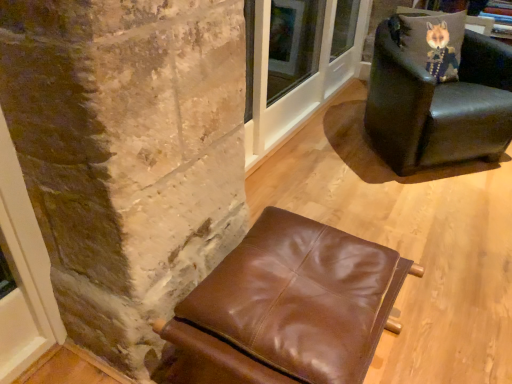
Question: From the image's perspective, is brown leather ottoman at lower center, which appears as the 1th chair when ordered from the bottom, positioned above or below velvet fox pillow at upper right?

Choices:
 (A) below
 (B) above

Answer: (A)

Question: Is brown leather ottoman at lower center, arranged as the 1th chair when viewed from the front, inside or outside of velvet fox pillow at upper right?

Choices:
 (A) inside
 (B) outside

Answer: (B)

Question: Which object is positioned farthest from the leather armchair at upper right, marked as the 2th chair in a front-to-back arrangement?

Choices:
 (A) brown leather ottoman at lower center, acting as the second chair starting from the right
 (B) velvet fox pillow at upper right

Answer: (A)

Question: Which object is positioned farthest from the brown leather ottoman at lower center, acting as the second chair starting from the right?

Choices:
 (A) velvet fox pillow at upper right
 (B) leather armchair at upper right, the 1th chair viewed from the top

Answer: (A)